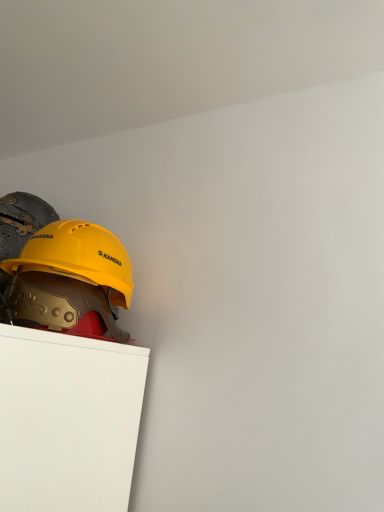
Question: Does yellow matte hard hat at left, arranged as the first helmet when viewed from the front, have a smaller size compared to yellow hard hat at upper left, the first helmet in the back-to-front sequence?

Choices:
 (A) no
 (B) yes

Answer: (B)

Question: Is yellow matte hard hat at left, positioned as the second helmet in back-to-front order, at the left side of yellow hard hat at upper left, acting as the 2th helmet starting from the front?

Choices:
 (A) yes
 (B) no

Answer: (A)

Question: Would you say yellow matte hard hat at left, arranged as the first helmet when viewed from the front, contains yellow hard hat at upper left, the first helmet in the back-to-front sequence?

Choices:
 (A) no
 (B) yes

Answer: (A)

Question: Does yellow matte hard hat at left, arranged as the first helmet when viewed from the front, have a lesser width compared to yellow hard hat at upper left, acting as the 2th helmet starting from the front?

Choices:
 (A) yes
 (B) no

Answer: (A)

Question: From the image's perspective, is yellow matte hard hat at left, positioned as the second helmet in back-to-front order, located beneath yellow hard hat at upper left, the first helmet in the back-to-front sequence?

Choices:
 (A) yes
 (B) no

Answer: (B)

Question: From the image's perspective, would you say yellow matte hard hat at left, positioned as the second helmet in back-to-front order, is positioned over yellow hard hat at upper left, acting as the 2th helmet starting from the front?

Choices:
 (A) yes
 (B) no

Answer: (A)

Question: From the image's perspective, does yellow hard hat at upper left, the first helmet in the back-to-front sequence, appear lower than yellow matte hard hat at left, positioned as the second helmet in back-to-front order?

Choices:
 (A) yes
 (B) no

Answer: (A)

Question: Would you say yellow matte hard hat at left, arranged as the first helmet when viewed from the front, is part of yellow hard hat at upper left, acting as the 2th helmet starting from the front,'s contents?

Choices:
 (A) yes
 (B) no

Answer: (B)

Question: Considering the relative sizes of yellow hard hat at upper left, acting as the 2th helmet starting from the front, and yellow matte hard hat at left, positioned as the second helmet in back-to-front order, in the image provided, is yellow hard hat at upper left, acting as the 2th helmet starting from the front, shorter than yellow matte hard hat at left, positioned as the second helmet in back-to-front order,?

Choices:
 (A) yes
 (B) no

Answer: (B)

Question: From a real-world perspective, is yellow hard hat at upper left, acting as the 2th helmet starting from the front, over yellow matte hard hat at left, arranged as the first helmet when viewed from the front?

Choices:
 (A) no
 (B) yes

Answer: (B)

Question: From a real-world perspective, is yellow hard hat at upper left, the first helmet in the back-to-front sequence, under yellow matte hard hat at left, arranged as the first helmet when viewed from the front?

Choices:
 (A) no
 (B) yes

Answer: (A)

Question: Is yellow hard hat at upper left, acting as the 2th helmet starting from the front, to the right of yellow matte hard hat at left, positioned as the second helmet in back-to-front order, from the viewer's perspective?

Choices:
 (A) no
 (B) yes

Answer: (B)

Question: Considering the relative positions of yellow hard hat at upper left, the first helmet in the back-to-front sequence, and yellow matte hard hat at left, positioned as the second helmet in back-to-front order, in the image provided, is yellow hard hat at upper left, the first helmet in the back-to-front sequence, to the left or to the right of yellow matte hard hat at left, positioned as the second helmet in back-to-front order,?

Choices:
 (A) left
 (B) right

Answer: (B)